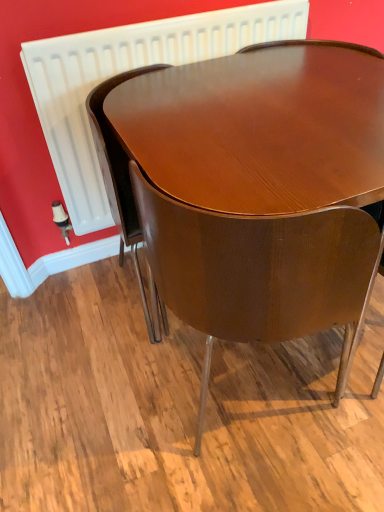
What is the approximate width of glossy wood chair at center, the first chair in the left-to-right sequence?

17.09 inches.

At what (x,y) coordinates should I click in order to perform the action: click on glossy wood chair at center, the first chair in the left-to-right sequence. Please return your answer as a coordinate pair (x, y). Looking at the image, I should click on (120, 180).

Can you confirm if glossy wood chair at center, which appears as the first chair when viewed from the right, is positioned to the left of glossy wood chair at center, the 2th chair viewed from the right?

In fact, glossy wood chair at center, which appears as the first chair when viewed from the right, is to the right of glossy wood chair at center, the 2th chair viewed from the right.

Measure the distance from glossy wood chair at center, the second chair positioned from the left, to glossy wood chair at center, the first chair in the left-to-right sequence.

glossy wood chair at center, the second chair positioned from the left, and glossy wood chair at center, the first chair in the left-to-right sequence, are 13.88 inches apart from each other.

Is glossy wood chair at center, the second chair positioned from the left, oriented towards glossy wood chair at center, the first chair in the left-to-right sequence?

Yes, glossy wood chair at center, the second chair positioned from the left, is oriented towards glossy wood chair at center, the first chair in the left-to-right sequence.

What's the angular difference between glossy wood chair at center, which appears as the first chair when viewed from the right, and glossy wood chair at center, the first chair in the left-to-right sequence,'s facing directions?

The facing directions of glossy wood chair at center, which appears as the first chair when viewed from the right, and glossy wood chair at center, the first chair in the left-to-right sequence, are 180 degrees apart.

Are glossy wood chair at center, the first chair in the left-to-right sequence, and white plastic radiator at upper center beside each other?

They are not placed beside each other.

Which is in front, glossy wood chair at center, the 2th chair viewed from the right, or white plastic radiator at upper center?

Positioned in front is glossy wood chair at center, the 2th chair viewed from the right.

Is glossy wood chair at center, the 2th chair viewed from the right, aimed at white plastic radiator at upper center?

No, glossy wood chair at center, the 2th chair viewed from the right, is not turned towards white plastic radiator at upper center.

This screenshot has width=384, height=512. In order to click on radiator above the glossy wood chair at center, the 2th chair viewed from the right (from a real-world perspective) in this screenshot , I will do `click(126, 70)`.

Between white plastic radiator at upper center and glossy wood chair at center, the second chair positioned from the left, which one appears on the left side from the viewer's perspective?

From the viewer's perspective, white plastic radiator at upper center appears more on the left side.

Consider the image. Is white plastic radiator at upper center wider or thinner than glossy wood chair at center, the second chair positioned from the left?

In the image, white plastic radiator at upper center appears to be more narrow than glossy wood chair at center, the second chair positioned from the left.

Is white plastic radiator at upper center looking in the opposite direction of glossy wood chair at center, the second chair positioned from the left?

No, white plastic radiator at upper center is not facing away from glossy wood chair at center, the second chair positioned from the left.

Looking at the image, does white plastic radiator at upper center seem bigger or smaller compared to glossy wood chair at center, the first chair in the left-to-right sequence?

In the image, white plastic radiator at upper center appears to be smaller than glossy wood chair at center, the first chair in the left-to-right sequence.

Can you confirm if white plastic radiator at upper center is positioned to the left of glossy wood chair at center, the first chair in the left-to-right sequence?

No, white plastic radiator at upper center is not to the left of glossy wood chair at center, the first chair in the left-to-right sequence.

Could you tell me if white plastic radiator at upper center is facing glossy wood chair at center, the first chair in the left-to-right sequence?

Yes, white plastic radiator at upper center is turned towards glossy wood chair at center, the first chair in the left-to-right sequence.

From a real-world perspective, is white plastic radiator at upper center located beneath glossy wood chair at center, the 2th chair viewed from the right?

No, from a real-world perspective, white plastic radiator at upper center is not below glossy wood chair at center, the 2th chair viewed from the right.

Which object is closer to the camera, glossy wood chair at center, the first chair in the left-to-right sequence, or glossy wood chair at center, which appears as the first chair when viewed from the right?

glossy wood chair at center, which appears as the first chair when viewed from the right, is more forward.

Which of these two, glossy wood chair at center, the first chair in the left-to-right sequence, or glossy wood chair at center, which appears as the first chair when viewed from the right, is thinner?

Thinner between the two is glossy wood chair at center, the first chair in the left-to-right sequence.

Looking at this image, considering the relative sizes of glossy wood chair at center, the 2th chair viewed from the right, and glossy wood chair at center, the second chair positioned from the left, in the image provided, is glossy wood chair at center, the 2th chair viewed from the right, bigger than glossy wood chair at center, the second chair positioned from the left,?

No, glossy wood chair at center, the 2th chair viewed from the right, is not bigger than glossy wood chair at center, the second chair positioned from the left.

The image size is (384, 512). What are the coordinates of `chair on the left of glossy wood chair at center, the second chair positioned from the left` in the screenshot? It's located at (120, 180).

Is glossy wood chair at center, the second chair positioned from the left, oriented towards white plastic radiator at upper center?

Yes, glossy wood chair at center, the second chair positioned from the left, is aimed at white plastic radiator at upper center.

How many degrees apart are the facing directions of glossy wood chair at center, the second chair positioned from the left, and white plastic radiator at upper center?

180 degrees separate the facing orientations of glossy wood chair at center, the second chair positioned from the left, and white plastic radiator at upper center.

Considering the relative sizes of glossy wood chair at center, the second chair positioned from the left, and white plastic radiator at upper center in the image provided, is glossy wood chair at center, the second chair positioned from the left, wider than white plastic radiator at upper center?

Yes.

Would you say glossy wood chair at center, which appears as the first chair when viewed from the right, contains white plastic radiator at upper center?

No, glossy wood chair at center, which appears as the first chair when viewed from the right, does not contain white plastic radiator at upper center.

The width and height of the screenshot is (384, 512). Find the location of `chair above the glossy wood chair at center, the second chair positioned from the left (from the image's perspective)`. chair above the glossy wood chair at center, the second chair positioned from the left (from the image's perspective) is located at coordinates (120, 180).

From a real-world perspective, which chair is the 1st one underneath the white plastic radiator at upper center? Please provide its 2D coordinates.

[(120, 180)]

Based on the photo, estimate the real-world distances between objects in this image. Which object is closer to white plastic radiator at upper center, glossy wood chair at center, the first chair in the left-to-right sequence, or glossy wood chair at center, which appears as the first chair when viewed from the right?

Based on the image, glossy wood chair at center, the first chair in the left-to-right sequence, appears to be nearer to white plastic radiator at upper center.

From the image, which object appears to be nearer to glossy wood chair at center, the first chair in the left-to-right sequence, glossy wood chair at center, which appears as the first chair when viewed from the right, or white plastic radiator at upper center?

white plastic radiator at upper center.

Based on their spatial positions, is white plastic radiator at upper center or glossy wood chair at center, the first chair in the left-to-right sequence, further from glossy wood chair at center, which appears as the first chair when viewed from the right?

Based on the image, white plastic radiator at upper center appears to be further to glossy wood chair at center, which appears as the first chair when viewed from the right.

Looking at this image, which object lies nearer to the anchor point glossy wood chair at center, the 2th chair viewed from the right, white plastic radiator at upper center or glossy wood chair at center, the second chair positioned from the left?

The object closer to glossy wood chair at center, the 2th chair viewed from the right, is white plastic radiator at upper center.

Based on their spatial positions, is glossy wood chair at center, the second chair positioned from the left, or glossy wood chair at center, the 2th chair viewed from the right, closer to white plastic radiator at upper center?

The object closer to white plastic radiator at upper center is glossy wood chair at center, the 2th chair viewed from the right.

From the image, which object appears to be farther from glossy wood chair at center, which appears as the first chair when viewed from the right, glossy wood chair at center, the 2th chair viewed from the right, or white plastic radiator at upper center?

white plastic radiator at upper center.

Find the location of a particular element. Image resolution: width=384 pixels, height=512 pixels. chair between white plastic radiator at upper center and glossy wood chair at center, which appears as the first chair when viewed from the right, from top to bottom is located at coordinates (120, 180).